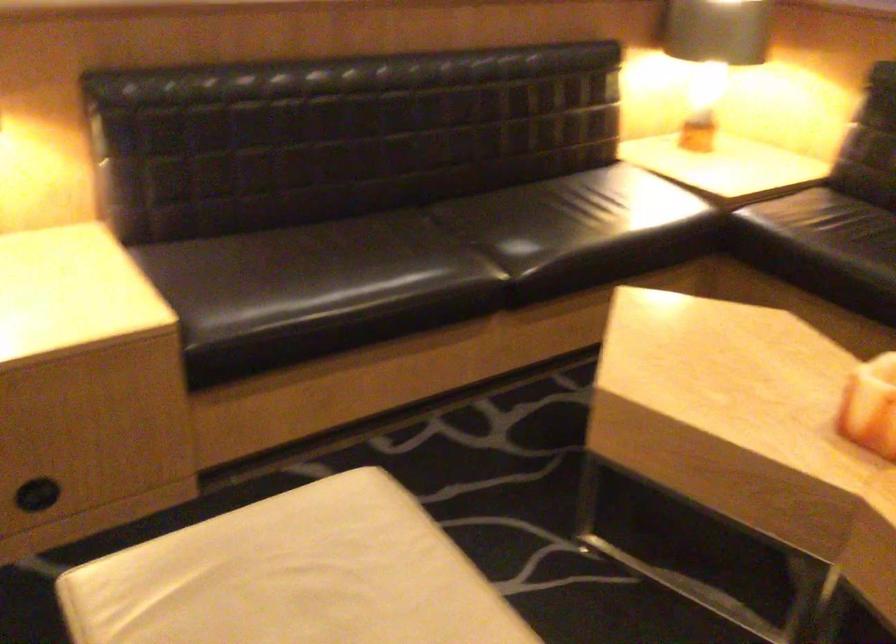
Identify the location of white chair sitting surface. (391, 610).